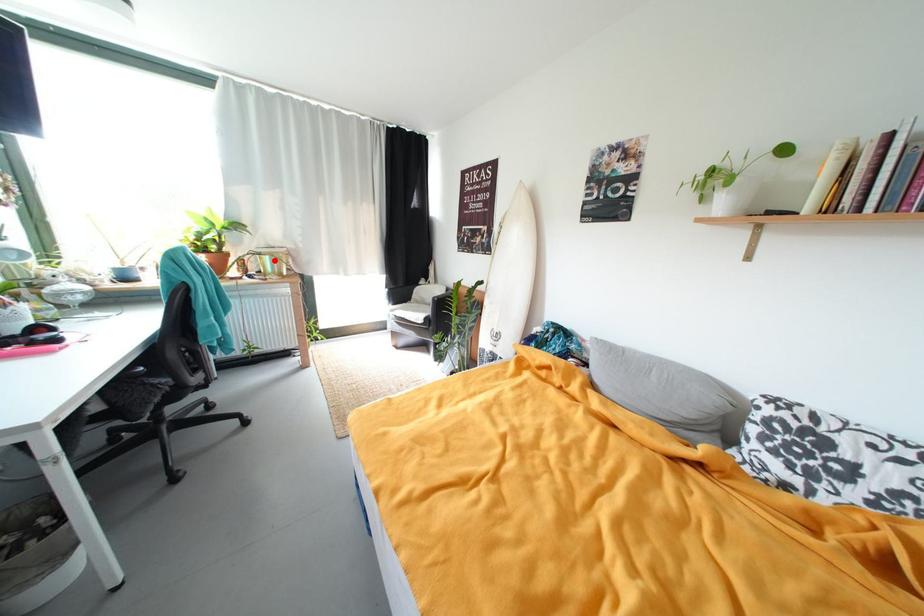
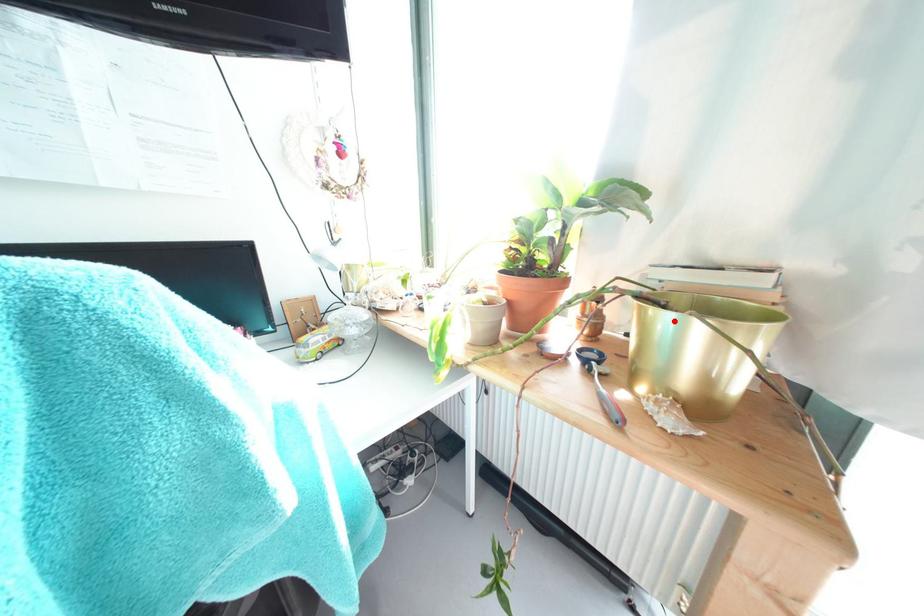
I am providing you with two images of the same scene from different viewpoints. A red point is marked on the first image and another point is marked on the second image. Are the points marked in image1 and image2 representing the same 3D position?

Yes